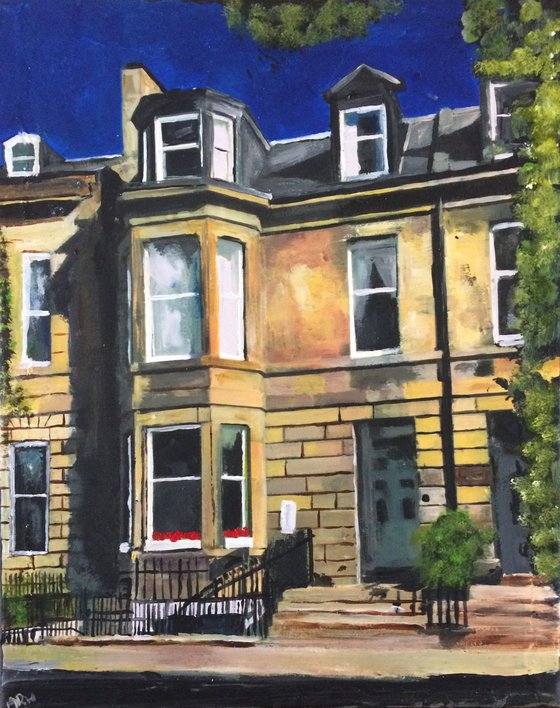
At what (x,y) coordinates should I click in order to perform the action: click on front door at top of stairs. Please return your answer as a coordinate pair (x, y). The width and height of the screenshot is (560, 708). Looking at the image, I should click on (374, 473).